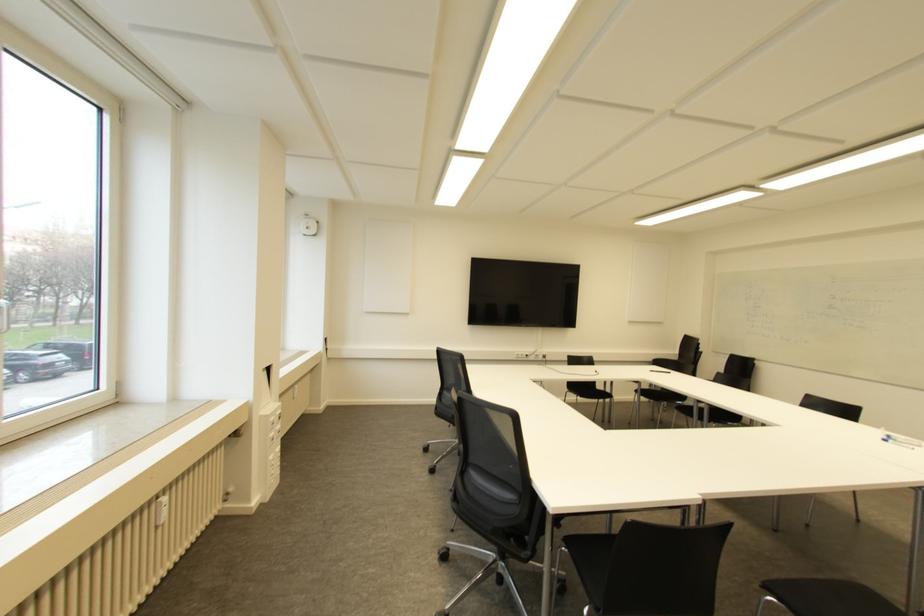
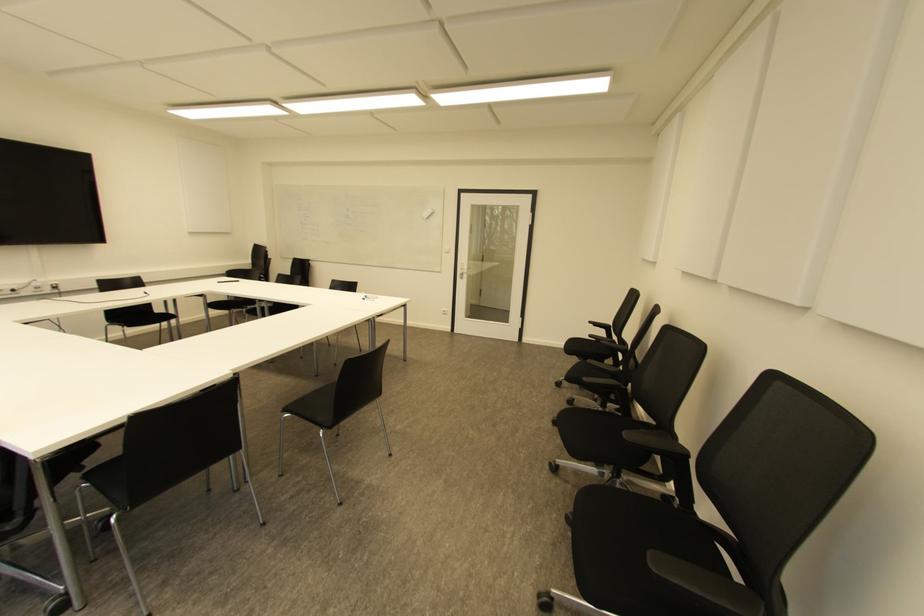
Question: The camera is either moving clockwise (left) or counter-clockwise (right) around the object. The first image is from the beginning of the video and the second image is from the end. Is the camera moving left or right when shooting the video?

Choices:
 (A) Left
 (B) Right

Answer: (A)